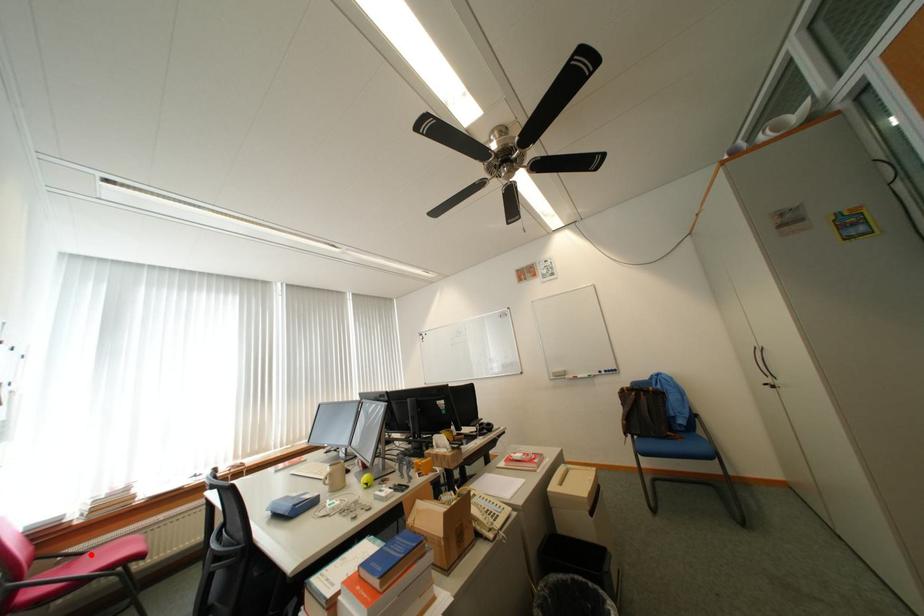
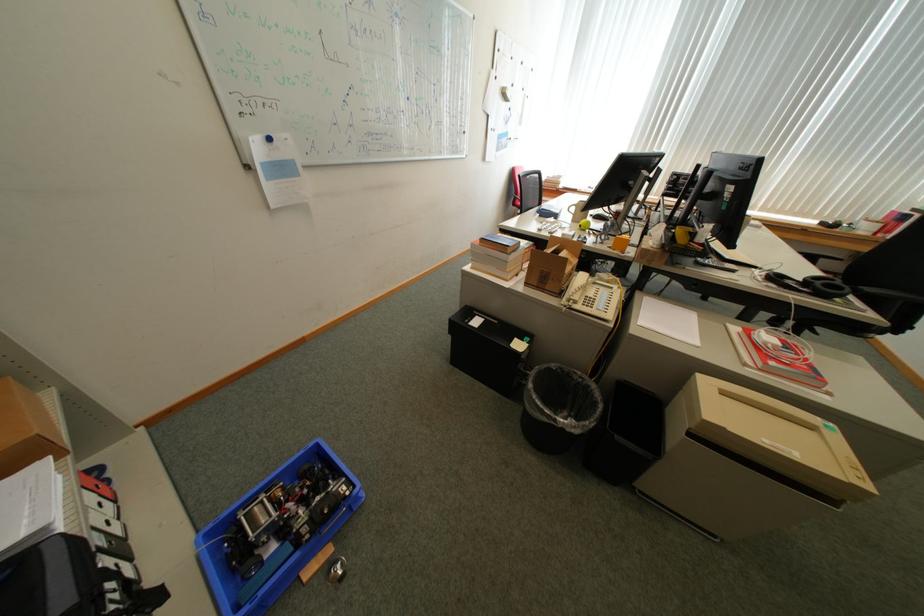
Question: I am providing you with two images of the same scene from different viewpoints. A red point is marked on the first image. Can you still see the location of the red point in image 2?

Choices:
 (A) Yes
 (B) No

Answer: (B)